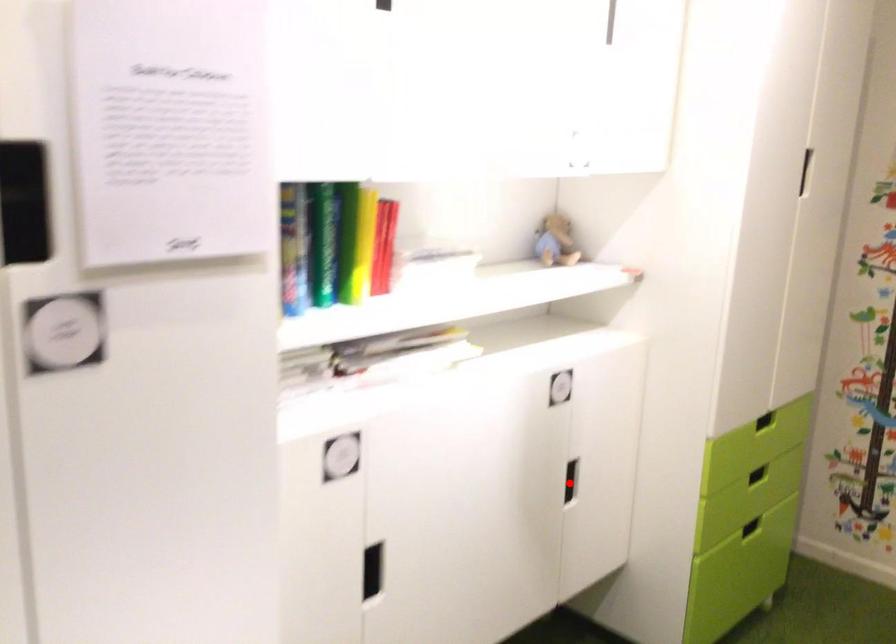
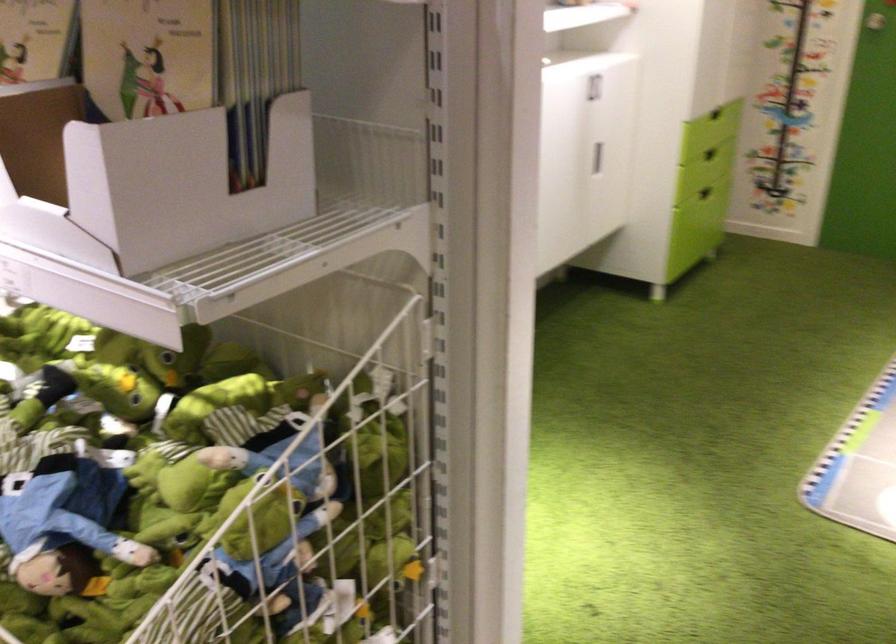
Find the pixel in the second image that matches the highlighted location in the first image.

(597, 158)